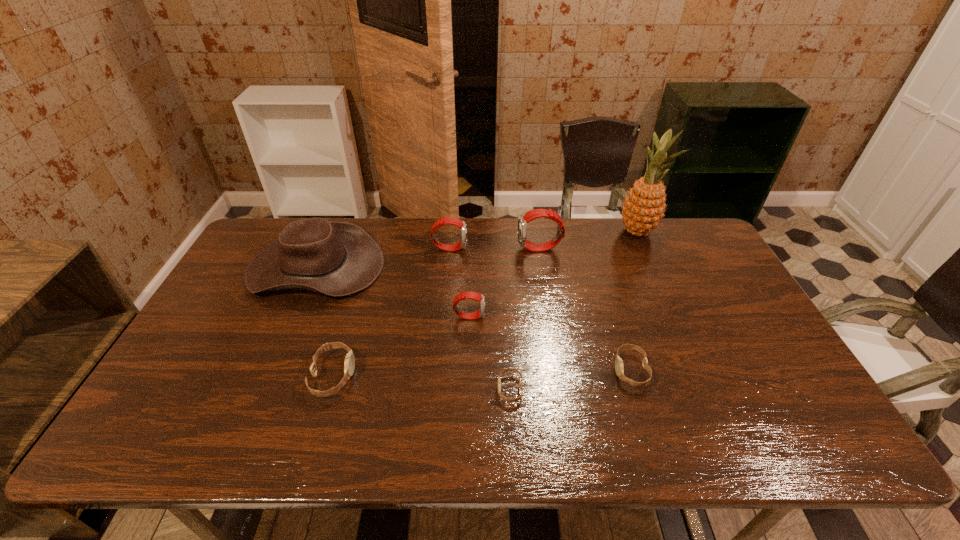
This screenshot has height=540, width=960. In order to click on object identified as the fourth closest to the cowboy hat in this screenshot , I will do `click(517, 399)`.

Where is `watch that is the fifth closest to the shortest object`? The image size is (960, 540). watch that is the fifth closest to the shortest object is located at coordinates (450, 220).

This screenshot has width=960, height=540. I want to click on watch that is the third closest one to the fourth nearest object, so click(x=536, y=213).

Locate which red watch is the second closest to the third shortest object. Please provide its 2D coordinates. Your answer should be formatted as a tuple, i.e. [(x, y)], where the tuple contains the x and y coordinates of a point satisfying the conditions above.

[(450, 220)]

Where is `red watch that stands as the closest to the second shortest watch`? The image size is (960, 540). red watch that stands as the closest to the second shortest watch is located at coordinates (464, 295).

Locate an element on the screen. the third closest beige watch to the fifth farthest object is located at coordinates (619, 367).

You are a GUI agent. You are given a task and a screenshot of the screen. Output one action in this format:
    pyautogui.click(x=<x>, y=<y>)
    Task: Click on the third closest beige watch to the rightmost object
    The image size is (960, 540).
    Given the screenshot: What is the action you would take?
    pyautogui.click(x=349, y=364)